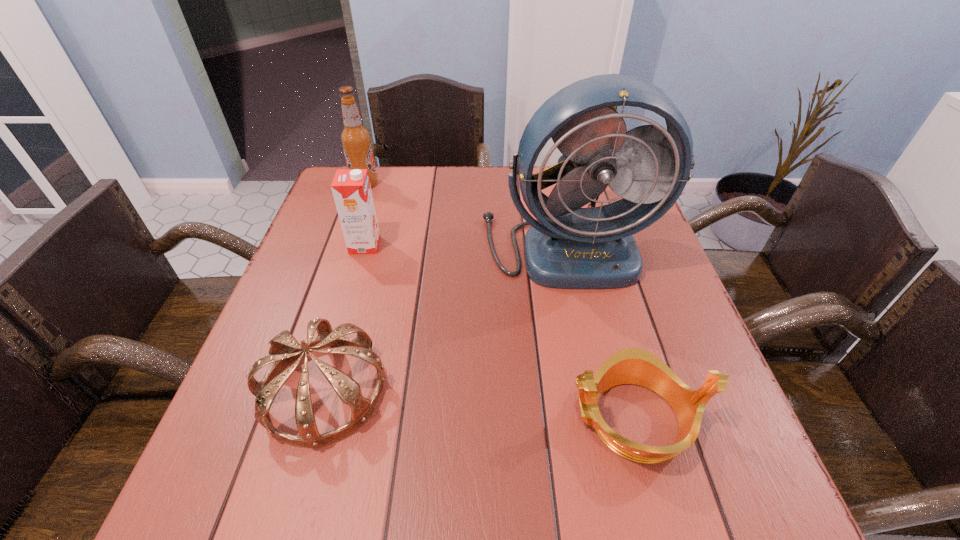
Image resolution: width=960 pixels, height=540 pixels. Identify the location of object at the far left corner. (356, 140).

Find the location of `object that is positioned at the near right corner`. object that is positioned at the near right corner is located at coordinates (636, 366).

The height and width of the screenshot is (540, 960). Identify the location of free space at the far edge of the desktop. (418, 200).

The image size is (960, 540). In order to click on vacant region at the near edge of the desktop in this screenshot , I will do `click(648, 516)`.

At what (x,y) coordinates should I click in order to perform the action: click on vacant space at the left edge of the desktop. Please return your answer as a coordinate pair (x, y). This screenshot has height=540, width=960. Looking at the image, I should click on 266,344.

Locate an element on the screen. The width and height of the screenshot is (960, 540). blank space at the right edge of the desktop is located at coordinates (683, 380).

Where is `vacant region at the near left corner of the desktop`? The image size is (960, 540). vacant region at the near left corner of the desktop is located at coordinates (290, 512).

Identify the location of vacant space in between the right tiara and the fan. (600, 333).

I want to click on free space between the right tiara and the third tallest object, so click(x=499, y=332).

The width and height of the screenshot is (960, 540). I want to click on empty space that is in between the farthest object and the tallest object, so click(x=466, y=215).